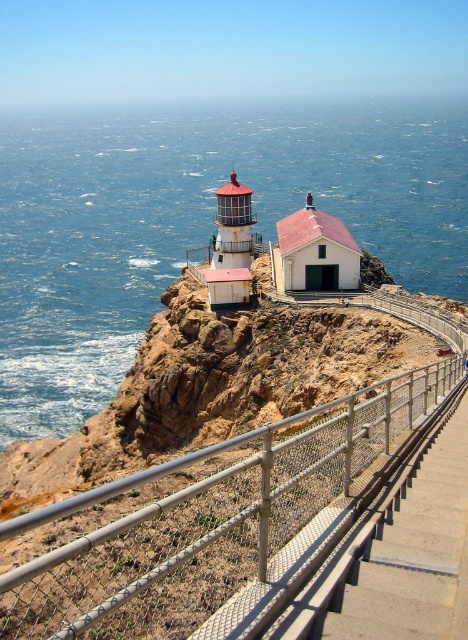
Question: In this image, where is blue water at upper left located relative to metal mesh railing at center?

Choices:
 (A) left
 (B) right

Answer: (B)

Question: Among these objects, which one is nearest to the camera?

Choices:
 (A) blue water at upper left
 (B) metal mesh railing at center

Answer: (B)

Question: Can you confirm if blue water at upper left is positioned to the left of metal mesh railing at center?

Choices:
 (A) yes
 (B) no

Answer: (B)

Question: In this image, where is blue water at upper left located relative to metal mesh railing at center?

Choices:
 (A) right
 (B) left

Answer: (A)

Question: Which point is farther to the camera?

Choices:
 (A) blue water at upper left
 (B) metal mesh railing at center

Answer: (A)